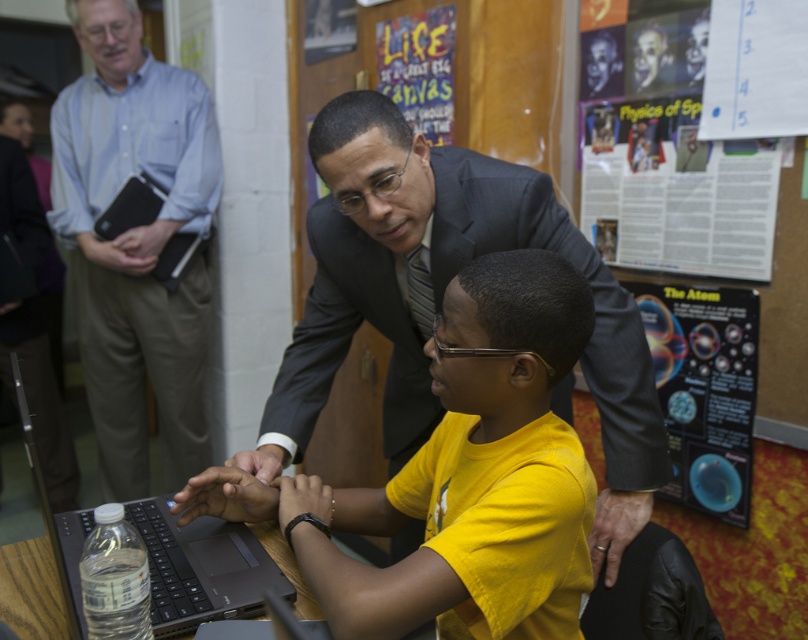
Which of these two, wooden table at lower center or matte black hand at center, stands taller?

Standing taller between the two is wooden table at lower center.

Who is more distant from viewer, (5, 564) or (276, 474)?

The point (276, 474) is more distant.

Where is `wooden table at lower center`? wooden table at lower center is located at coordinates (32, 589).

Does point (432, 20) come farther from viewer compared to point (177, 502)?

That is True.

Find the location of a particular element. This screenshot has height=640, width=808. matte canvas poster at upper center is located at coordinates (419, 68).

Does point (423, 125) lie behind point (213, 504)?

Yes, point (423, 125) is behind point (213, 504).

You are a GUI agent. You are given a task and a screenshot of the screen. Output one action in this format:
    pyautogui.click(x=<x>, y=<y>)
    Task: Click on the matte canvas poster at upper center
    The width and height of the screenshot is (808, 640).
    Given the screenshot: What is the action you would take?
    pyautogui.click(x=419, y=68)

Who is positioned more to the right, light blue shirt at upper left or paper poster at upper right?

paper poster at upper right is more to the right.

How far apart are light blue shirt at upper left and paper poster at upper right?

light blue shirt at upper left is 1.56 meters away from paper poster at upper right.

Between point (85, 144) and point (758, 196), which one is positioned behind?

The point (85, 144) is behind.

This screenshot has width=808, height=640. Find the location of `light blue shirt at upper left`. light blue shirt at upper left is located at coordinates (137, 243).